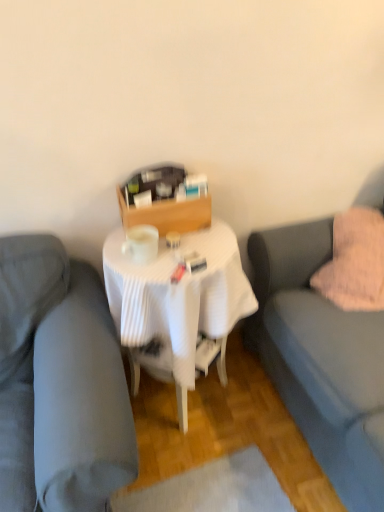
Where is `free point in front of white pleated tablecloth at center`? free point in front of white pleated tablecloth at center is located at coordinates (222, 477).